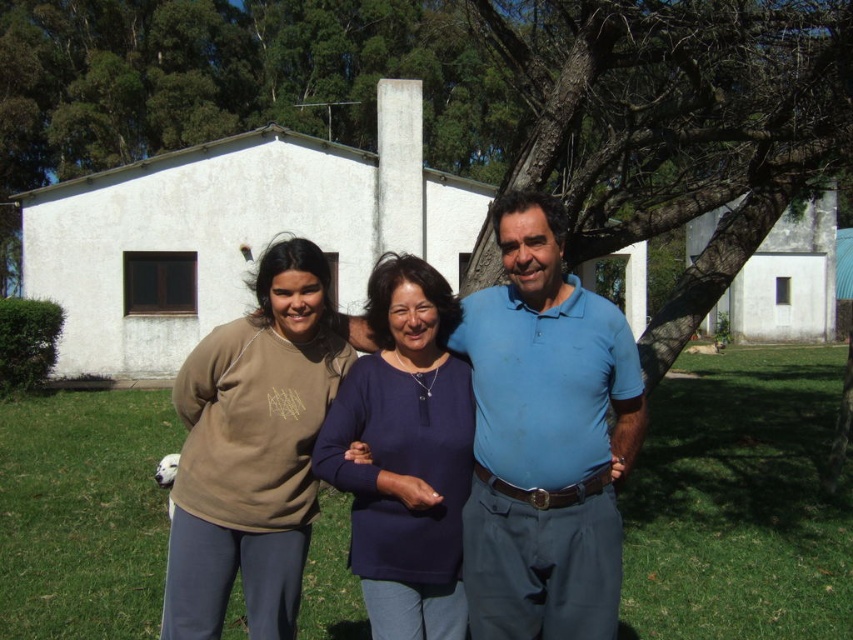
You are a photographer trying to capture a clear shot of the navy blue sweater at center and the matte brown sweatshirt at center. Since both are at the center, which one might block the view of the other?

The navy blue sweater at center is behind matte brown sweatshirt at center, so the matte brown sweatshirt at center will block the view of the navy blue sweater at center.

You are taking a photo of two people wearing blue cotton shirt at center and navy blue sweater at center. Which one should you zoom in on to capture more details of their clothing?

The blue cotton shirt at center is larger in size than the navy blue sweater at center, so you should zoom in on the blue cotton shirt at center to capture more details of their clothing.

You are trying to decide which of the two people at the center of the image is closer to the camera. The two people are wearing a blue cotton shirt at center and a navy blue sweater at center. Based on their height in the image, which one is more likely to be closer?

The blue cotton shirt at center is much taller than the navy blue sweater at center, so the blue cotton shirt at center is more likely to be closer to the camera.